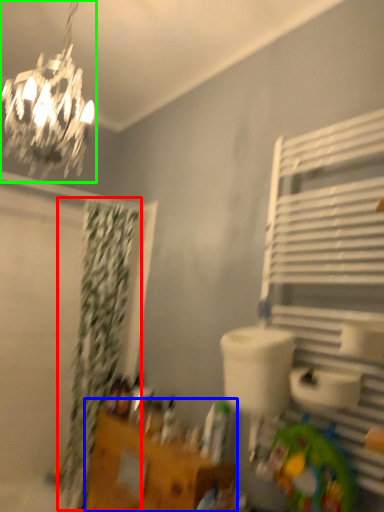
Question: Which is nearer to the shower curtain (highlighted by a red box)? vanity (highlighted by a blue box) or lamp (highlighted by a green box).

Choices:
 (A) vanity
 (B) lamp

Answer: (A)